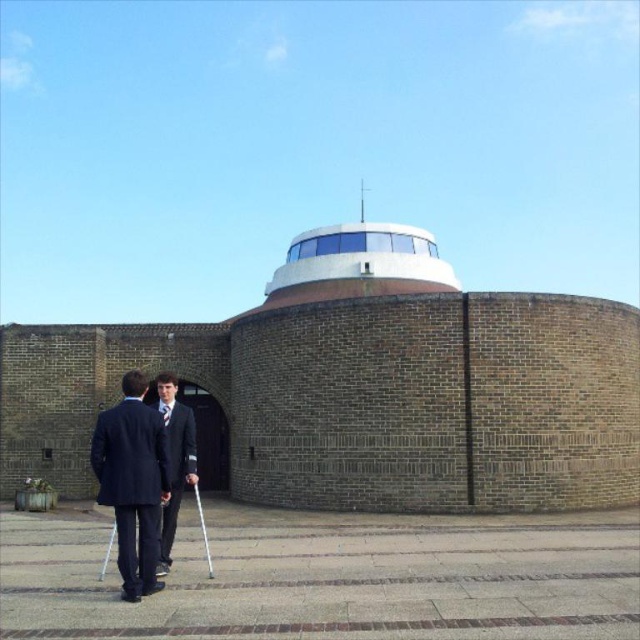
Measure the distance between point (365, 246) and camera.

A distance of 69.78 meters exists between point (365, 246) and camera.

Measure the distance between white smooth dome at center and matte black suit at center.

46.30 meters

Does point (397, 253) come closer to viewer compared to point (186, 436)?

No, (397, 253) is further to viewer.

Image resolution: width=640 pixels, height=640 pixels. Find the location of `white smooth dome at center`. white smooth dome at center is located at coordinates pos(362,256).

Which of these two, dark blue suit at lower left or matte black suit at center, stands taller?

With more height is dark blue suit at lower left.

Does dark blue suit at lower left have a larger size compared to matte black suit at center?

Indeed, dark blue suit at lower left has a larger size compared to matte black suit at center.

Identify the location of dark blue suit at lower left. This screenshot has height=640, width=640. (132, 481).

Which is in front, point (147, 440) or point (420, 244)?

Positioned in front is point (147, 440).

Does dark blue suit at lower left have a lesser height compared to white smooth dome at center?

Correct, dark blue suit at lower left is not as tall as white smooth dome at center.

Is point (152, 451) farther from camera compared to point (348, 230)?

No, it is not.

The height and width of the screenshot is (640, 640). I want to click on dark blue suit at lower left, so 132,481.